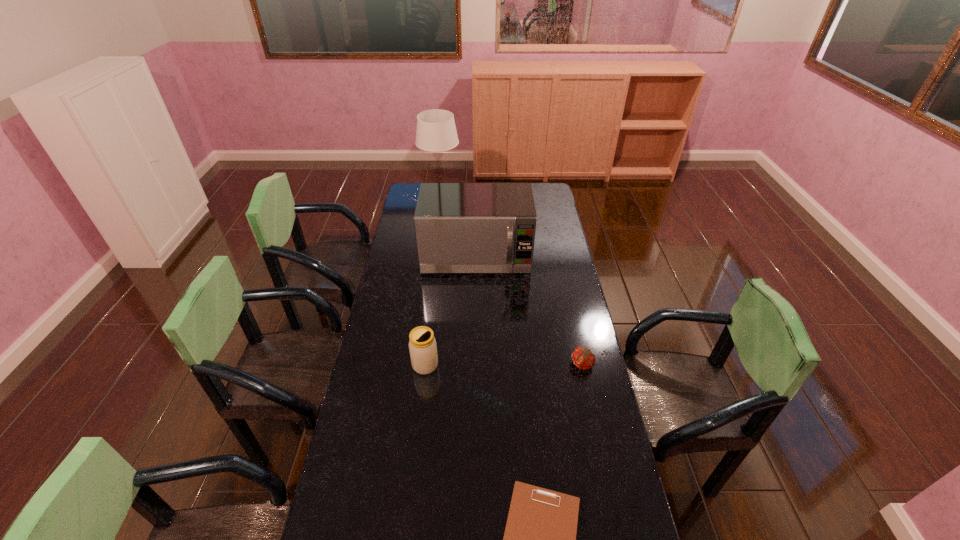
Image resolution: width=960 pixels, height=540 pixels. I want to click on vacant space located on the front of the rightmost object, so point(588,388).

Locate an element on the screen. The height and width of the screenshot is (540, 960). object at the far edge is located at coordinates (436, 131).

This screenshot has width=960, height=540. I want to click on table lamp that is at the left edge, so click(436, 131).

The height and width of the screenshot is (540, 960). Find the location of `microwave oven present at the left edge`. microwave oven present at the left edge is located at coordinates (460, 227).

You are a GUI agent. You are given a task and a screenshot of the screen. Output one action in this format:
    pyautogui.click(x=<x>, y=<y>)
    Task: Click on the object positioned at the right edge
    This screenshot has width=960, height=540.
    Given the screenshot: What is the action you would take?
    pyautogui.click(x=583, y=358)

Identify the location of object present at the far left corner. This screenshot has height=540, width=960. (436, 131).

In the image, there is a desktop. Identify the location of vacant area at the left edge. The image size is (960, 540). (397, 299).

I want to click on free space at the right edge of the desktop, so click(x=615, y=475).

You are a GUI agent. You are given a task and a screenshot of the screen. Output one action in this format:
    pyautogui.click(x=<x>, y=<y>)
    Task: Click on the vacant area at the far right corner
    The image size is (960, 540).
    Given the screenshot: What is the action you would take?
    pyautogui.click(x=556, y=204)

In order to click on vacant area between the third tallest object and the rightmost object in this screenshot , I will do `click(504, 364)`.